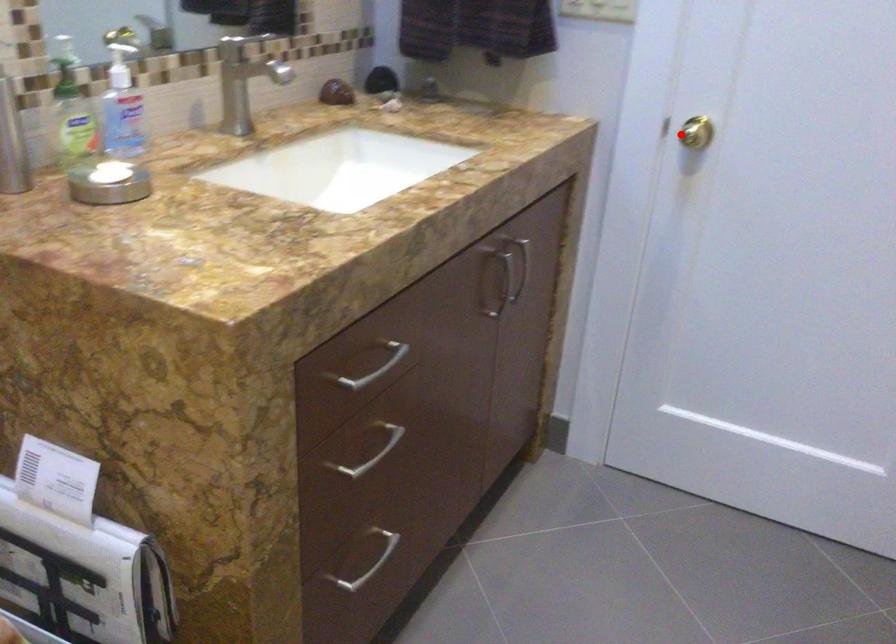
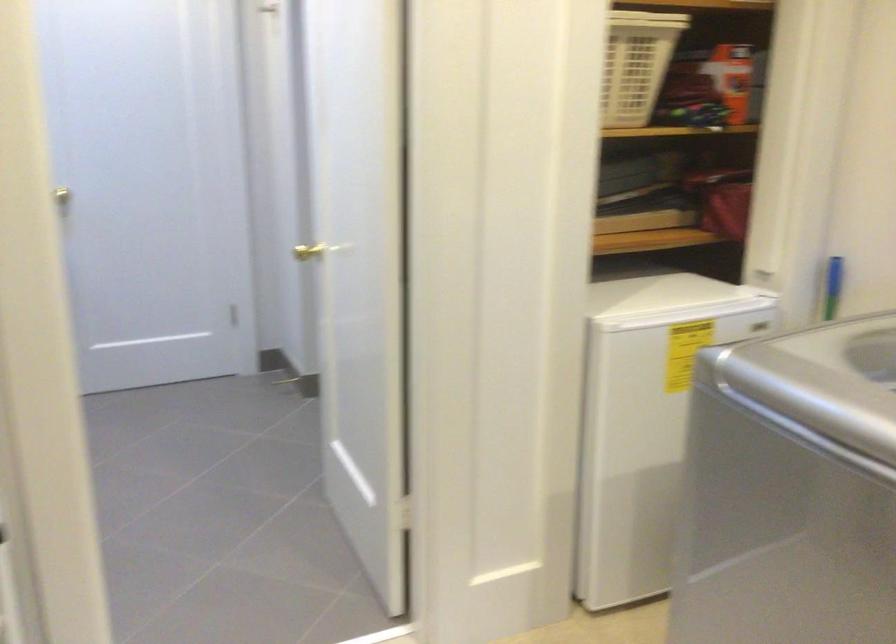
Locate, in the second image, the point that corresponds to the highlighted location in the first image.

(71, 192)